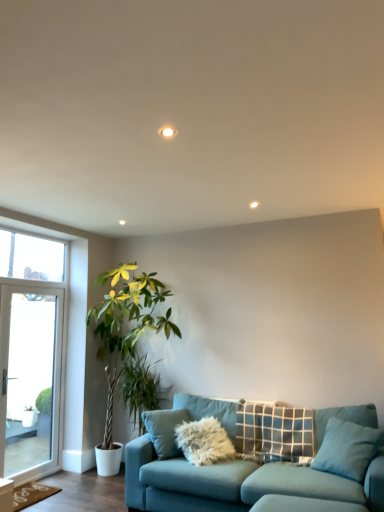
Describe the element at coordinates (141, 388) in the screenshot. I see `green leafy plant at left` at that location.

This screenshot has height=512, width=384. I want to click on green leafy plant at left, so click(x=141, y=388).

Describe the element at coordinates (274, 431) in the screenshot. I see `plaid fabric pillow at center, marked as the first pillow in a back-to-front arrangement` at that location.

Find the location of a particular element. This screenshot has height=512, width=384. clear glass door at left is located at coordinates (33, 357).

Find the location of `green leafy plant at left`. green leafy plant at left is located at coordinates (125, 335).

This screenshot has width=384, height=512. What do you see at coordinates (125, 335) in the screenshot? I see `green leafy plant at left` at bounding box center [125, 335].

At what (x,y) coordinates should I click in order to perform the action: click on transparent glass window at left. Please return your answer as a coordinate pair (x, y). Image resolution: width=384 pixels, height=512 pixels. Looking at the image, I should click on (31, 257).

Locate an element on the screen. green leafy plant at left is located at coordinates (141, 388).

From the image's perspective, which is above, blue fabric pillow at lower right, acting as the second pillow starting from the back, or teal fabric couch at lower center?

blue fabric pillow at lower right, acting as the second pillow starting from the back, is shown above in the image.

Considering the positions of objects blue fabric pillow at lower right, which appears as the first pillow when viewed from the front, and teal fabric couch at lower center in the image provided, who is behind, blue fabric pillow at lower right, which appears as the first pillow when viewed from the front, or teal fabric couch at lower center?

Positioned behind is blue fabric pillow at lower right, which appears as the first pillow when viewed from the front.

How many degrees apart are the facing directions of blue fabric pillow at lower right, which appears as the first pillow when viewed from the front, and teal fabric couch at lower center?

The facing directions of blue fabric pillow at lower right, which appears as the first pillow when viewed from the front, and teal fabric couch at lower center are 28.1 degrees apart.

Which object is positioned more to the left, blue fabric pillow at lower right, which appears as the first pillow when viewed from the front, or teal fabric couch at lower center?

Positioned to the left is teal fabric couch at lower center.

What are the coordinates of `houseplant above the teal fabric couch at lower center (from a real-world perspective)` in the screenshot? It's located at (125, 335).

Is there a large distance between teal fabric couch at lower center and green leafy plant at left?

That's right, there is a large distance between teal fabric couch at lower center and green leafy plant at left.

Considering the sizes of objects teal fabric couch at lower center and green leafy plant at left in the image provided, who is smaller, teal fabric couch at lower center or green leafy plant at left?

teal fabric couch at lower center.

Is teal fabric couch at lower center wider or thinner than green leafy plant at left?

Clearly, teal fabric couch at lower center has more width compared to green leafy plant at left.

In the scene shown: Measure the distance from blue fabric pillow at lower right, which appears as the first pillow when viewed from the front, to green leafy plant at left.

blue fabric pillow at lower right, which appears as the first pillow when viewed from the front, and green leafy plant at left are 6.87 feet apart.

Which object is more forward, blue fabric pillow at lower right, acting as the second pillow starting from the back, or green leafy plant at left?

Positioned in front is blue fabric pillow at lower right, acting as the second pillow starting from the back.

Do you think blue fabric pillow at lower right, which appears as the first pillow when viewed from the front, is within green leafy plant at left, or outside of it?

blue fabric pillow at lower right, which appears as the first pillow when viewed from the front, is located beyond the bounds of green leafy plant at left.

From the image's perspective, which is above, blue fabric pillow at lower right, acting as the second pillow starting from the back, or green leafy plant at left?

green leafy plant at left.

Is there a large distance between transparent glass window at left and clear glass door at left?

No, transparent glass window at left is not far from clear glass door at left.

Find the location of `window on the right of transparent glass window at left`. window on the right of transparent glass window at left is located at coordinates (33, 357).

From their relative heights in the image, would you say transparent glass window at left is taller or shorter than clear glass door at left?

Clearly, transparent glass window at left is shorter compared to clear glass door at left.

From a real-world perspective, which is physically above, transparent glass window at left or clear glass door at left?

transparent glass window at left.

Is blue fabric pillow at lower right, which appears as the first pillow when viewed from the front, in contact with clear glass door at left?

There is a gap between blue fabric pillow at lower right, which appears as the first pillow when viewed from the front, and clear glass door at left.

Is point (350, 474) closer or farther from the camera than point (20, 328)?

Clearly, point (350, 474) is closer to the camera than point (20, 328).

This screenshot has height=512, width=384. I want to click on window on the left of the blue fabric pillow at lower right, which appears as the first pillow when viewed from the front, so click(x=33, y=357).

Which object is thinner, blue fabric pillow at lower right, which appears as the first pillow when viewed from the front, or clear glass door at left?

→ With smaller width is clear glass door at left.

Is green leafy plant at left directly adjacent to clear glass door at left?

No, green leafy plant at left is not next to clear glass door at left.

Is point (124, 297) positioned after point (25, 294)?

No, (124, 297) is closer to viewer.

Which object is positioned more to the right, green leafy plant at left or clear glass door at left?

green leafy plant at left is more to the right.

Can you confirm if green leafy plant at left is smaller than clear glass door at left?

No.

Between blue fabric pillow at lower right, which appears as the first pillow when viewed from the front, and green leafy plant at left, which one appears on the right side from the viewer's perspective?

From the viewer's perspective, blue fabric pillow at lower right, which appears as the first pillow when viewed from the front, appears more on the right side.

Between blue fabric pillow at lower right, which appears as the first pillow when viewed from the front, and green leafy plant at left, which one has larger width?

Wider between the two is green leafy plant at left.

Which is less distant, (363, 426) or (141, 432)?

Positioned in front is point (363, 426).

At what (x,y) coordinates should I click in order to perform the action: click on the 1st pillow directly above the teal fabric couch at lower center (from a real-world perspective). Please return your answer as a coordinate pair (x, y). Image resolution: width=384 pixels, height=512 pixels. Looking at the image, I should click on (347, 449).

At what (x,y) coordinates should I click in order to perform the action: click on studio couch in front of the green leafy plant at left. Please return your answer as a coordinate pair (x, y). This screenshot has height=512, width=384. Looking at the image, I should click on (248, 463).

When comparing their distances from plaid fabric pillow at center, which ranks as the second pillow in front-to-back order, does clear glass door at left or teal fabric couch at lower center seem further?

clear glass door at left is positioned further to the anchor plaid fabric pillow at center, which ranks as the second pillow in front-to-back order.

Estimate the real-world distances between objects in this image. Which object is further from blue fabric pillow at lower right, acting as the second pillow starting from the back, teal fabric couch at lower center or green leafy plant at left?

green leafy plant at left.

When comparing their distances from blue fabric pillow at lower right, which appears as the first pillow when viewed from the front, does clear glass door at left or teal fabric couch at lower center seem further?

The object further to blue fabric pillow at lower right, which appears as the first pillow when viewed from the front, is clear glass door at left.

Considering their positions, is green leafy plant at left positioned closer to plaid fabric pillow at center, which ranks as the second pillow in front-to-back order, than teal fabric couch at lower center?

teal fabric couch at lower center is positioned closer to the anchor plaid fabric pillow at center, which ranks as the second pillow in front-to-back order.

Which object lies further to the anchor point blue fabric pillow at lower right, acting as the second pillow starting from the back, plaid fabric pillow at center, which ranks as the second pillow in front-to-back order, or teal fabric couch at lower center?

Based on the image, teal fabric couch at lower center appears to be further to blue fabric pillow at lower right, acting as the second pillow starting from the back.

When comparing their distances from transparent glass window at left, does blue fabric pillow at lower right, which appears as the first pillow when viewed from the front, or clear glass door at left seem closer?

clear glass door at left lies closer to transparent glass window at left than the other object.

When comparing their distances from green leafy plant at left, does blue fabric pillow at lower right, acting as the second pillow starting from the back, or transparent glass window at left seem further?

The object further to green leafy plant at left is blue fabric pillow at lower right, acting as the second pillow starting from the back.

Estimate the real-world distances between objects in this image. Which object is further from green leafy plant at left, green leafy plant at left or plaid fabric pillow at center, marked as the first pillow in a back-to-front arrangement?

Based on the image, plaid fabric pillow at center, marked as the first pillow in a back-to-front arrangement, appears to be further to green leafy plant at left.

Find the location of a particular element. This screenshot has height=512, width=384. pillow between green leafy plant at left and blue fabric pillow at lower right, which appears as the first pillow when viewed from the front, from left to right is located at coordinates (274, 431).

Identify the location of window between transparent glass window at left and blue fabric pillow at lower right, acting as the second pillow starting from the back. (33, 357).

Locate an element on the screen. pillow between green leafy plant at left and blue fabric pillow at lower right, acting as the second pillow starting from the back, from left to right is located at coordinates (274, 431).

Locate an element on the screen. The image size is (384, 512). plant between green leafy plant at left and plaid fabric pillow at center, marked as the first pillow in a back-to-front arrangement, from left to right is located at coordinates (141, 388).